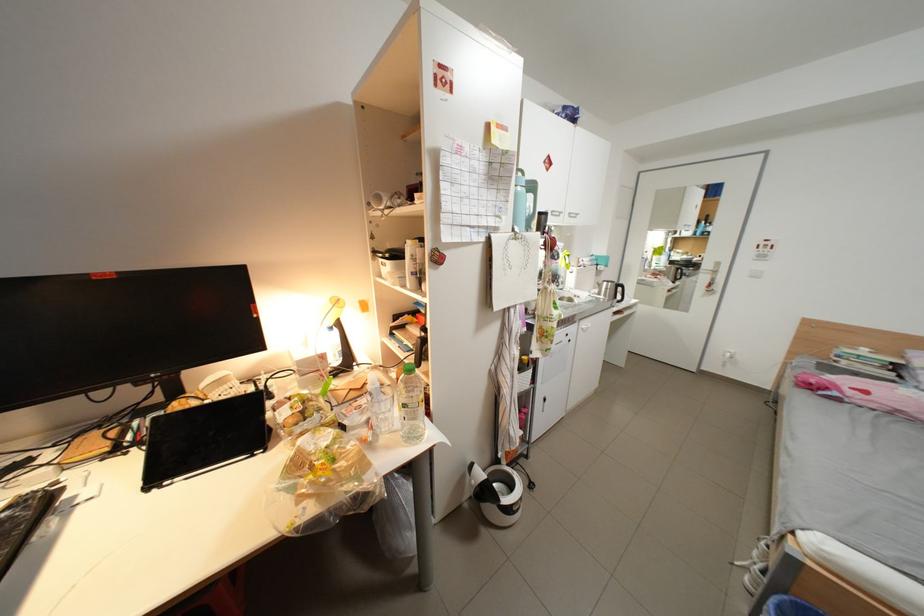
Where would you press the white light switch? Please return your answer as a coordinate pair (x, y).

(756, 272)